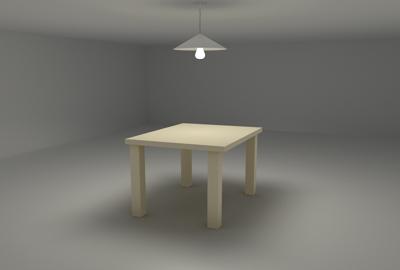
I want to click on table, so click(x=209, y=138).